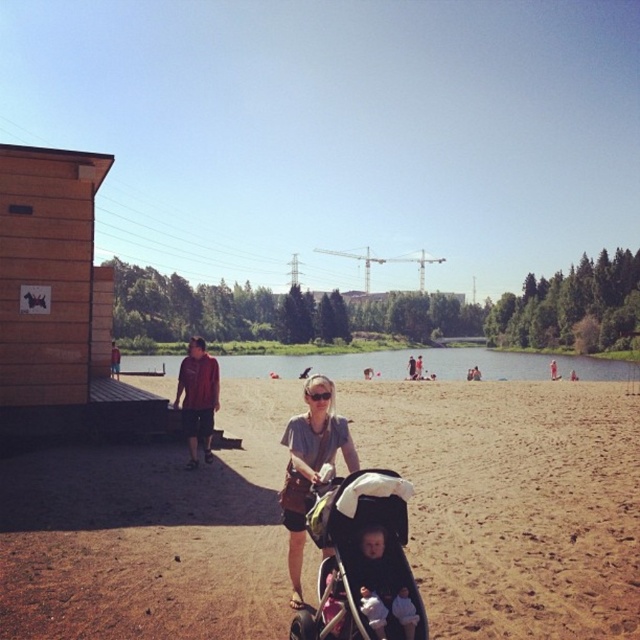
Question: Based on their relative distances, which object is farther from the reddish-brown leather jacket at left?

Choices:
 (A) matte gray shirt at center
 (B) green grassy lake at center
 (C) wooden hut at left

Answer: (B)

Question: Which point is closer to the camera?

Choices:
 (A) light gray fabric baby at center
 (B) matte gray shirt at center
 (C) white cotton shirt at center

Answer: (C)

Question: Among these objects, which one is nearest to the camera?

Choices:
 (A) reddish-brown leather jacket at left
 (B) green grassy lake at center
 (C) brown sand at center
 (D) wooden hut at left

Answer: (C)

Question: Is green grassy lake at center wider than matte gray shirt at center?

Choices:
 (A) yes
 (B) no

Answer: (A)

Question: Is black fabric stroller at center below matte gray shirt at center?

Choices:
 (A) yes
 (B) no

Answer: (A)

Question: Does black fabric stroller at center have a greater width compared to light gray fabric baby at center?

Choices:
 (A) no
 (B) yes

Answer: (B)